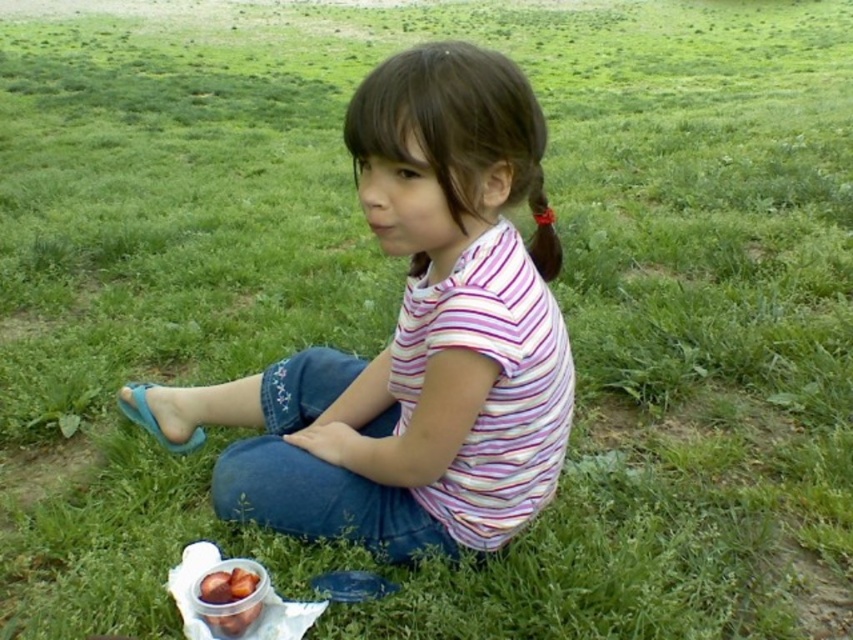
You are standing in the field where the girl is sitting. There are two points marked in the image. The first point is at coordinates point (416, 180) and the second point is at point (202, 577). If you want to reach the point that is closer to you first, which coordinate should you head towards?

You should head towards point (416, 180) because it is closer to the viewer than point (202, 577).

Based on the photo, you are a photographer trying to capture the girl in the image. You want to ensure both the striped cotton shirt at center and the shiny plastic container of nuts at lower left are clearly visible in your photo. Given their sizes, which object should you focus on to ensure both are in focus?

The striped cotton shirt at center is larger than the shiny plastic container of nuts at lower left, so focusing on the shirt will ensure both are in focus since it is the larger object.